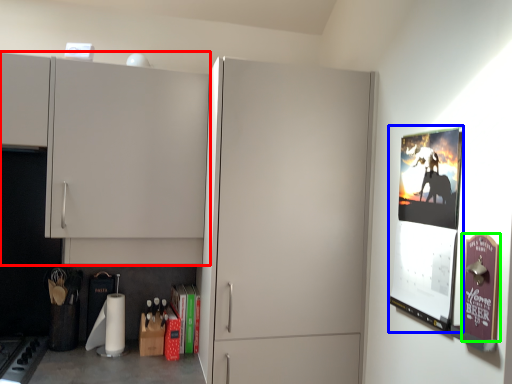
Question: Which is nearer to the cupboard (highlighted by a red box)? poster page (highlighted by a blue box) or poster page (highlighted by a green box).

Choices:
 (A) poster page
 (B) poster page

Answer: (A)